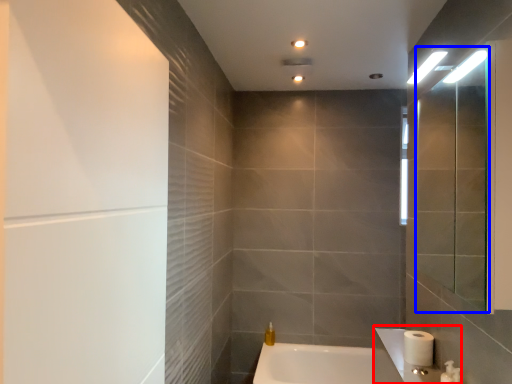
Question: Which of the following is the farthest to the observer, sink (highlighted by a red box) or mirror (highlighted by a blue box)?

Choices:
 (A) sink
 (B) mirror

Answer: (A)